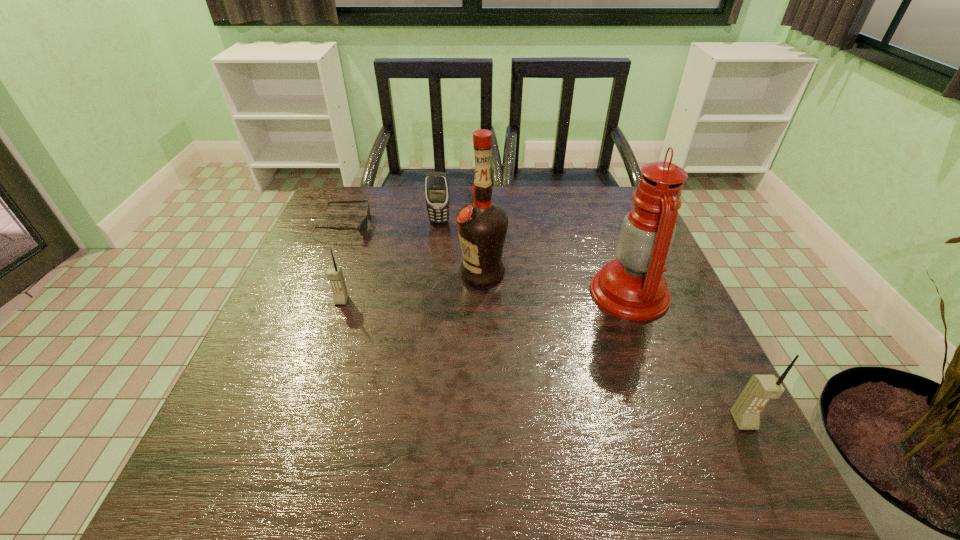
Identify the location of cellular telephone at the right edge. Image resolution: width=960 pixels, height=540 pixels. (760, 389).

Where is `oil lamp located at the right edge`? oil lamp located at the right edge is located at coordinates (632, 287).

The height and width of the screenshot is (540, 960). Find the location of `object at the far left corner`. object at the far left corner is located at coordinates (362, 228).

Where is `object that is at the near right corner`? This screenshot has height=540, width=960. object that is at the near right corner is located at coordinates (760, 389).

Where is `vacant area at the far edge`? vacant area at the far edge is located at coordinates (492, 198).

Identify the location of vacant space at the left edge of the desktop. (273, 380).

Find the location of a particular element. free space at the right edge of the desktop is located at coordinates (600, 245).

You are a GUI agent. You are given a task and a screenshot of the screen. Output one action in this format:
    pyautogui.click(x=<x>, y=<y>)
    Task: Click on the vacant space at the near left corner of the desktop
    
    Given the screenshot: What is the action you would take?
    pyautogui.click(x=250, y=436)

Locate an element on the screen. The height and width of the screenshot is (540, 960). vacant space at the far right corner of the desktop is located at coordinates (598, 201).

Find the location of a particular element. The width and height of the screenshot is (960, 540). vacant space at the near right corner of the desktop is located at coordinates (702, 440).